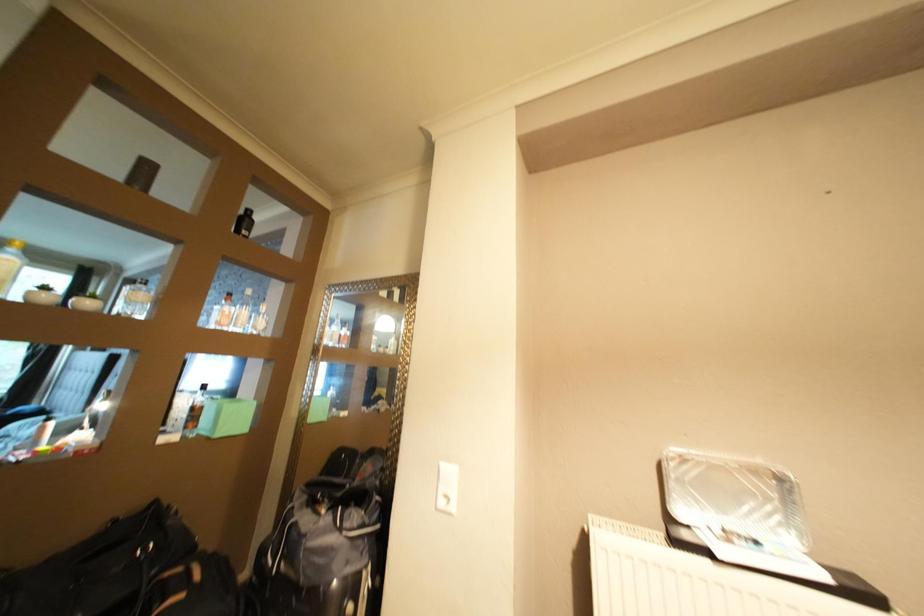
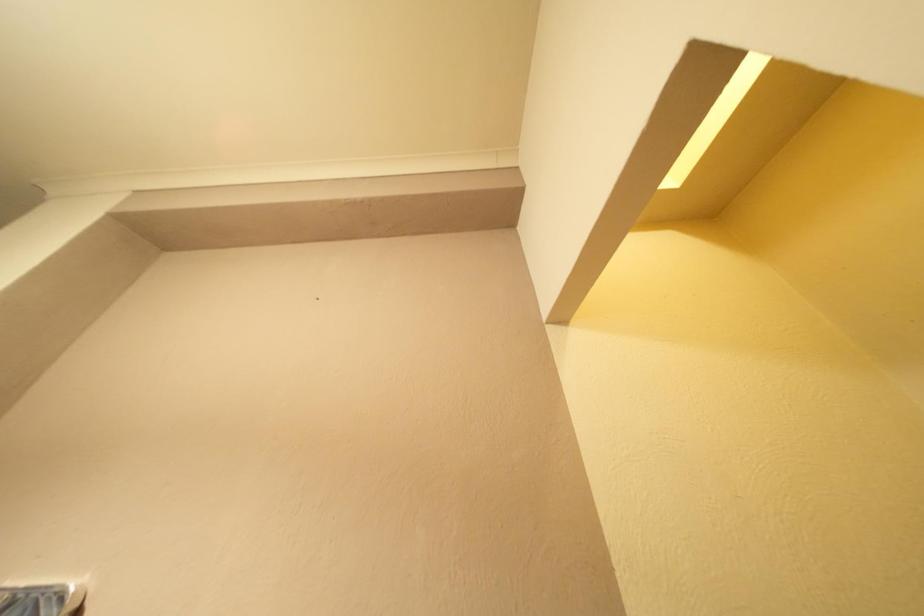
Question: The images are taken continuously from a first-person perspective. In which direction are you moving?

Choices:
 (A) Left
 (B) Right
 (C) Forward
 (D) Backward

Answer: (B)